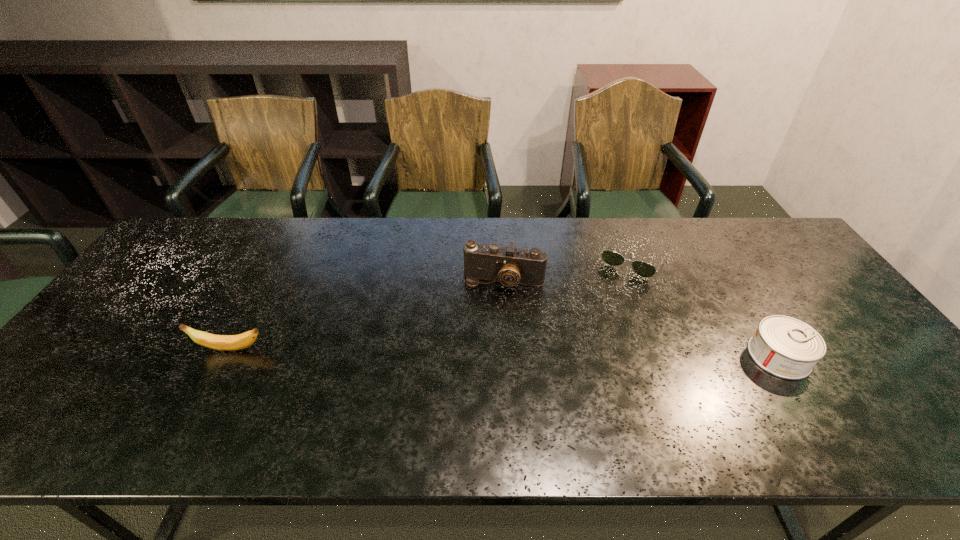
At what (x,y) coordinates should I click in order to perform the action: click on vacant space on the desktop that is between the banana and the rightmost object and is positioned on the front-facing side of the tallest object. Please return your answer as a coordinate pair (x, y). The height and width of the screenshot is (540, 960). Looking at the image, I should click on (488, 352).

Find the location of a particular element. Image resolution: width=960 pixels, height=540 pixels. free space on the desktop that is between the banana and the rightmost object and is positioned on the front-facing side of the shortest object is located at coordinates (578, 354).